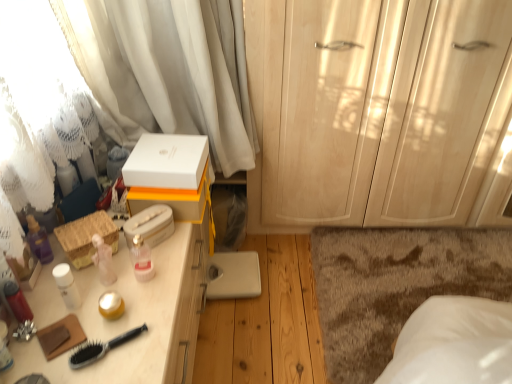
Where is `vacant space to the right of black plastic brush at lower left`? vacant space to the right of black plastic brush at lower left is located at coordinates (146, 343).